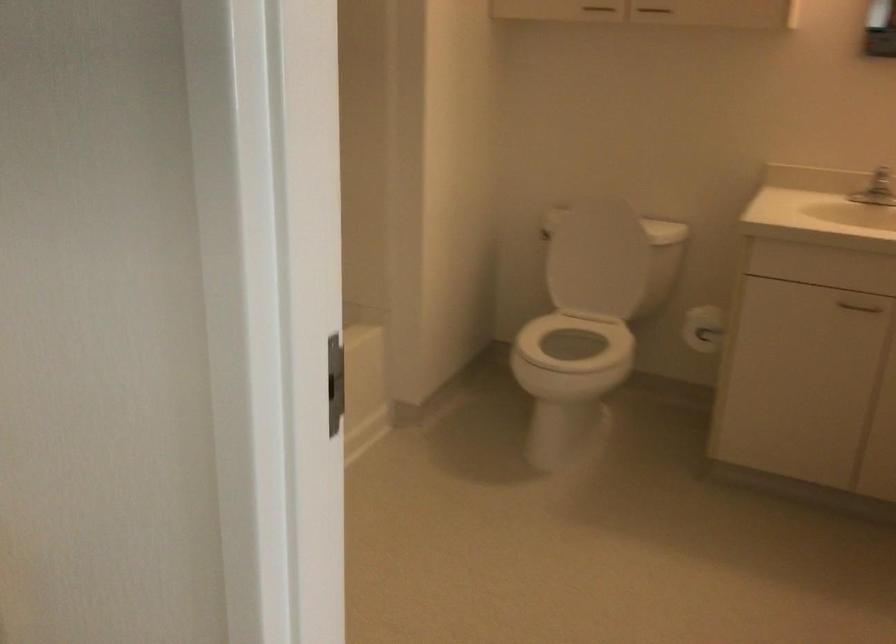
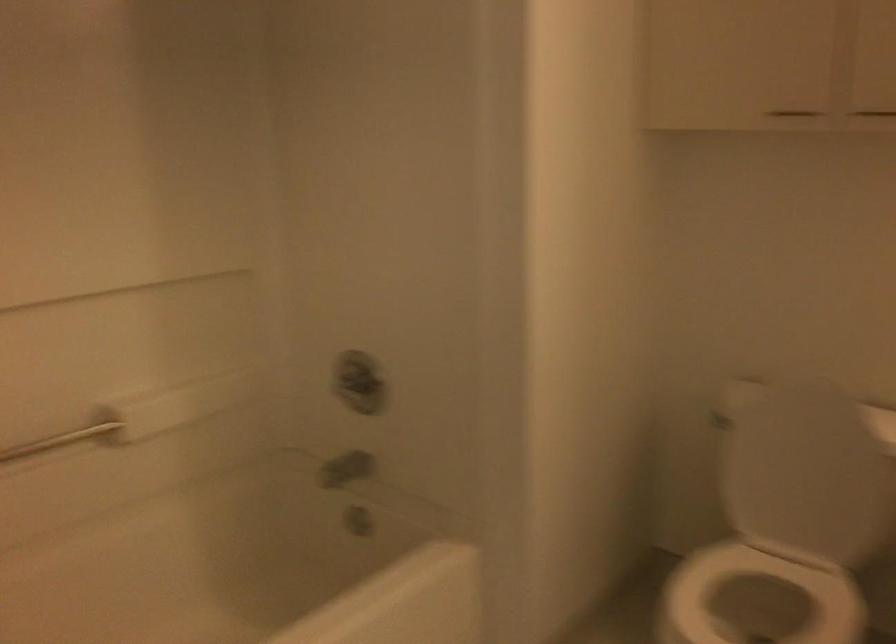
Which direction would the cameraman need to move to produce the second image?

The movement direction of the cameraman is right, forward.